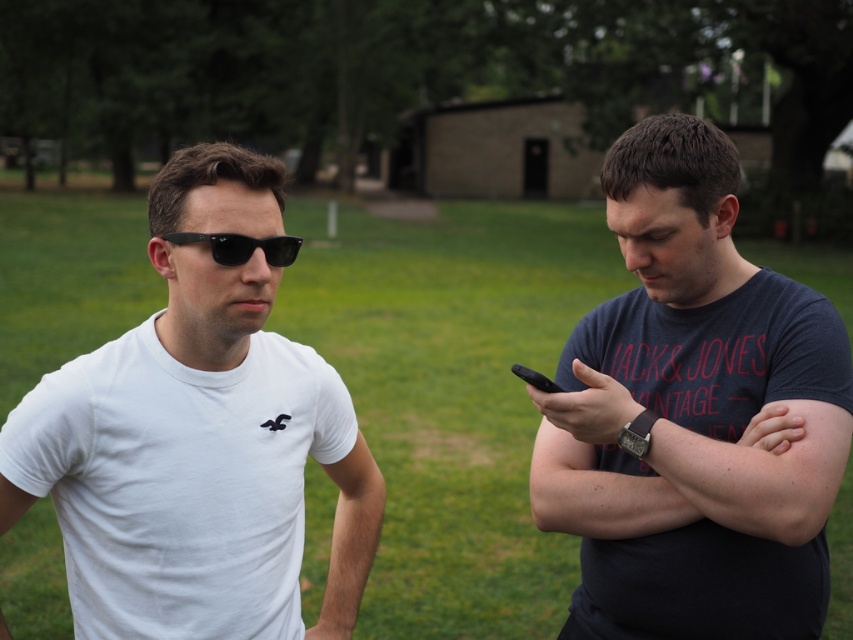
Question: Which object is the closest to the white matte t-shirt at left?

Choices:
 (A) white smooth t-shirt at left
 (B) black matte sunglasses at left
 (C) dark blue cotton t-shirt at right
 (D) dark blue fabric at right

Answer: (A)

Question: Which point is farther to the camera?

Choices:
 (A) (587, 438)
 (B) (524, 380)
 (C) (618, 424)
 (D) (219, 326)

Answer: (A)

Question: Can you confirm if dark blue cotton t-shirt at right is bigger than white matte t-shirt at left?

Choices:
 (A) no
 (B) yes

Answer: (B)

Question: Which point appears closest to the camera in this image?

Choices:
 (A) (523, 380)
 (B) (221, 352)

Answer: (B)

Question: Can you confirm if black matte sunglasses at left is smaller than black matte smartphone at right?

Choices:
 (A) no
 (B) yes

Answer: (A)

Question: Is dark blue cotton t-shirt at right wider than dark blue fabric at right?

Choices:
 (A) no
 (B) yes

Answer: (B)